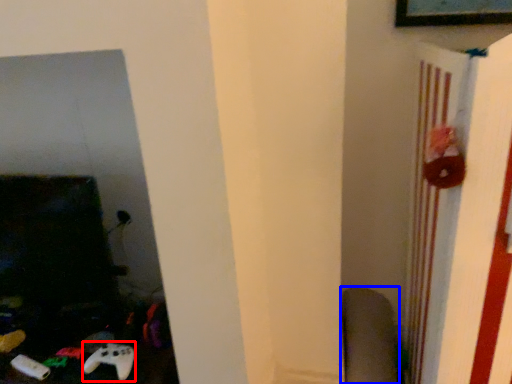
Question: Which point is closer to the camera, game controller (highlighted by a red box) or swivel chair (highlighted by a blue box)?

Choices:
 (A) game controller
 (B) swivel chair

Answer: (A)